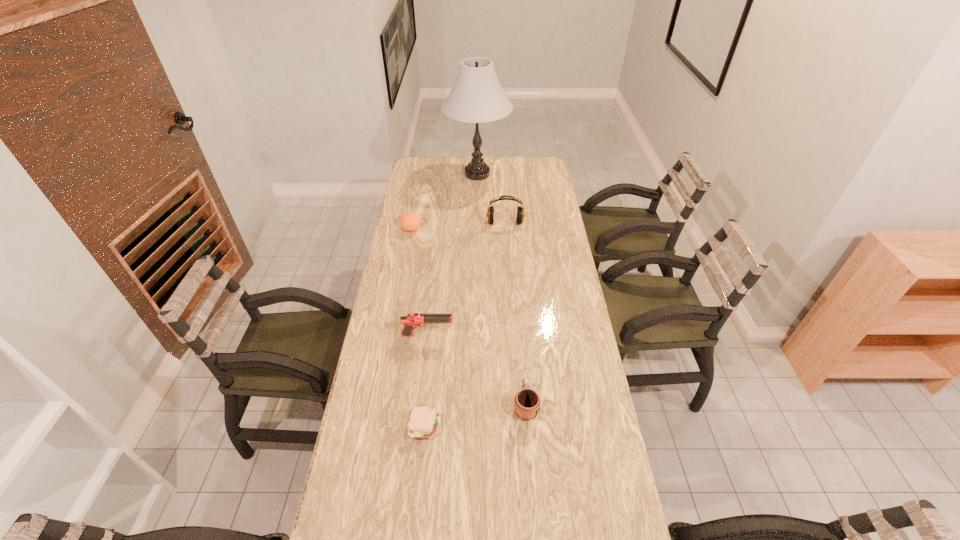
Find the location of a particular element. The height and width of the screenshot is (540, 960). blank region between the third nearest object and the headset is located at coordinates (467, 279).

The image size is (960, 540). I want to click on free spot between the lamp and the mug, so click(x=501, y=289).

Find the location of a particular element. This screenshot has width=960, height=540. vacant space that's between the patty and the gun is located at coordinates (426, 381).

Find the location of a particular element. The height and width of the screenshot is (540, 960). free point between the shortest object and the third nearest object is located at coordinates (426, 381).

At what (x,y) coordinates should I click in order to perform the action: click on the third closest object to the fourth tallest object. Please return your answer as a coordinate pair (x, y). The image size is (960, 540). Looking at the image, I should click on (412, 320).

The width and height of the screenshot is (960, 540). Find the location of `the second closest object to the fifth shortest object`. the second closest object to the fifth shortest object is located at coordinates (410, 221).

Locate an element on the screen. The height and width of the screenshot is (540, 960). free region that satisfies the following two spatial constraints: 1. on the side of the mug with the handle; 2. at the aiming end of the fourth farthest object is located at coordinates (520, 335).

Where is `free space in the image that satisfies the following two spatial constraints: 1. at the aiming end of the fourth farthest object; 2. on the side of the mug with the handle`? Image resolution: width=960 pixels, height=540 pixels. free space in the image that satisfies the following two spatial constraints: 1. at the aiming end of the fourth farthest object; 2. on the side of the mug with the handle is located at coordinates (420, 404).